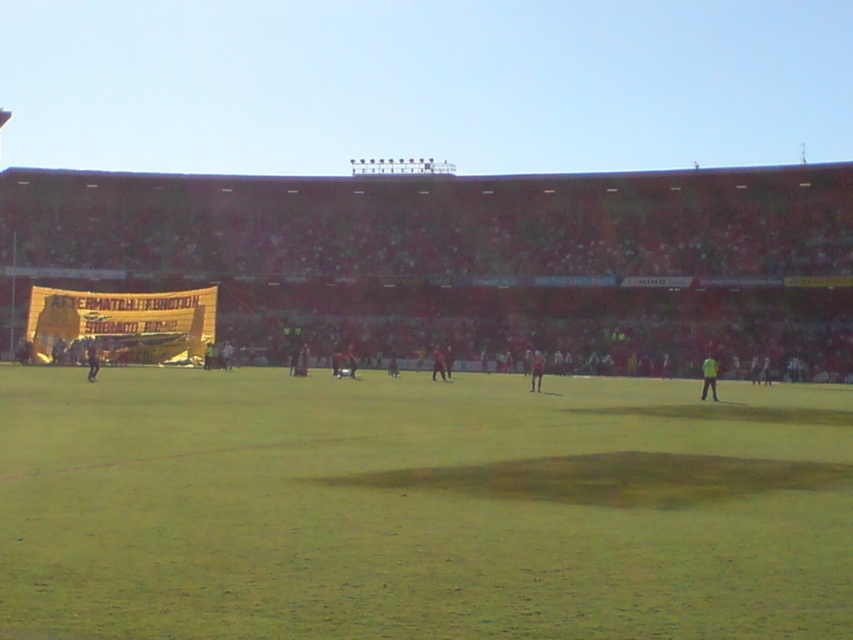
The width and height of the screenshot is (853, 640). What do you see at coordinates (419, 508) in the screenshot?
I see `green grass field at center` at bounding box center [419, 508].

Which is behind, point (787, 598) or point (712, 378)?

Point (712, 378)

Find the location of a particular element. Image resolution: width=853 pixels, height=640 pixels. green grass field at center is located at coordinates (419, 508).

Which is above, green matte person at center or dark green jersey at left?

dark green jersey at left is above.

Measure the distance from green matte person at center to dark green jersey at left.

green matte person at center is 26.18 meters from dark green jersey at left.

Is point (711, 376) positioned after point (96, 368)?

No, it is not.

Identify the location of green matte person at center. (709, 378).

What do you see at coordinates (419, 508) in the screenshot? This screenshot has width=853, height=640. I see `green grass field at center` at bounding box center [419, 508].

Between point (686, 636) and point (444, 368), which one is positioned behind?

Point (444, 368)

Between point (36, 435) and point (436, 374), which one is positioned behind?

Point (436, 374)

Locate an element on the screen. The height and width of the screenshot is (640, 853). green grass field at center is located at coordinates (419, 508).